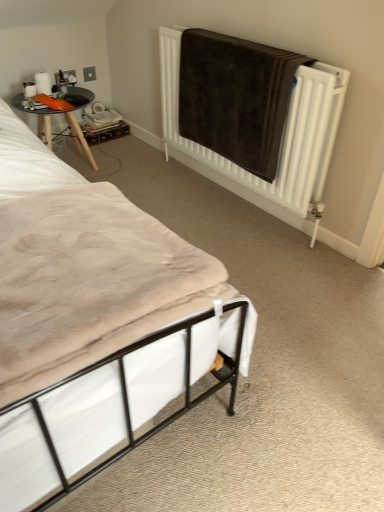
The height and width of the screenshot is (512, 384). What are the coordinates of `vacant space underneath brown towel at upper right (from a real-world perspective)` in the screenshot? It's located at (225, 202).